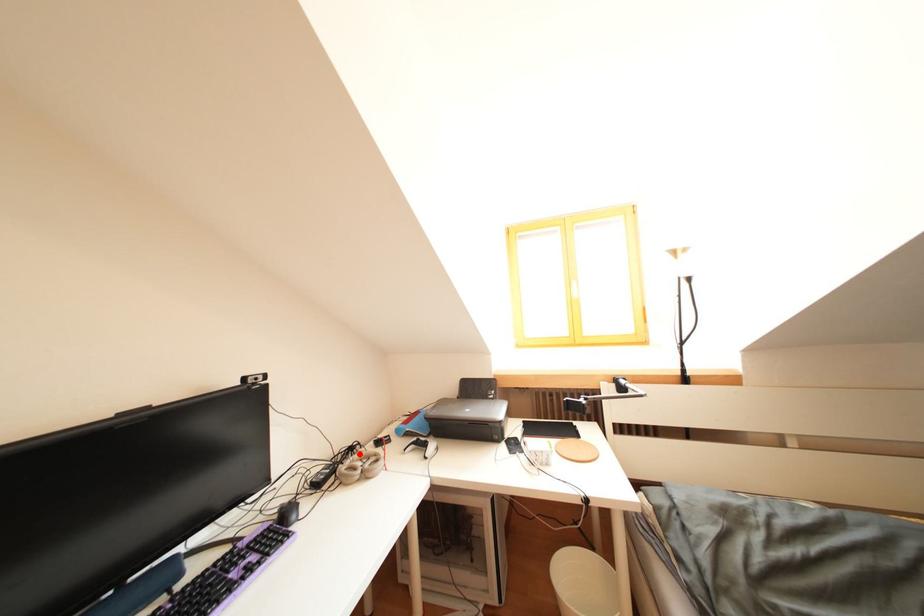
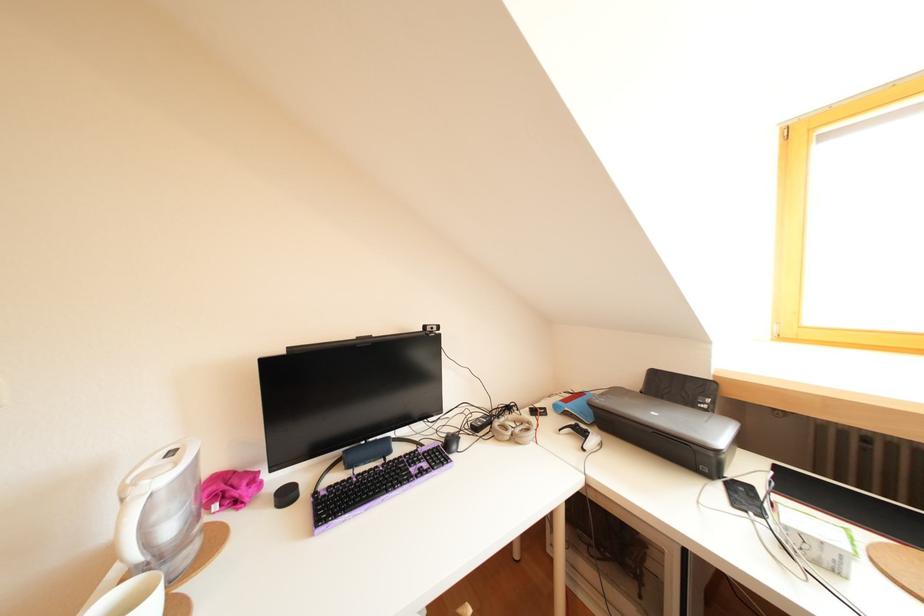
Find the pixel in the second image that matches the highlighted location in the first image.

(516, 413)